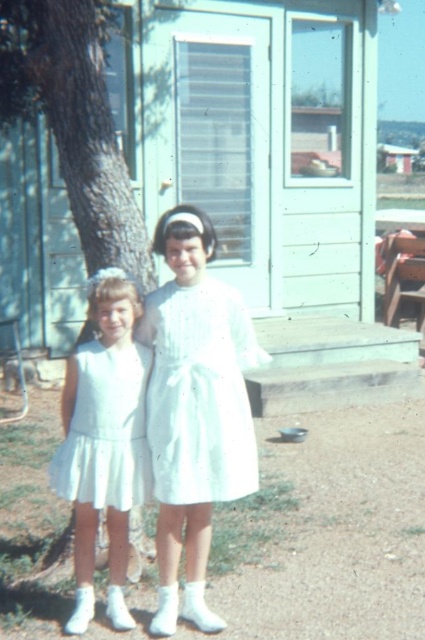
Question: Is green textured tree trunk at left wider than white satin dress at center?

Choices:
 (A) no
 (B) yes

Answer: (B)

Question: Which object is closer to the camera taking this photo?

Choices:
 (A) green textured tree trunk at left
 (B) white pleated dress at center
 (C) white satin dress at left
 (D) white satin dress at center

Answer: (D)

Question: Can you confirm if white satin dress at center is thinner than white pleated dress at center?

Choices:
 (A) yes
 (B) no

Answer: (A)

Question: Among these points, which one is nearest to the camera?

Choices:
 (A) (221, 339)
 (B) (87, 522)

Answer: (B)

Question: Among these objects, which one is nearest to the camera?

Choices:
 (A) white satin dress at left
 (B) green textured tree trunk at left
 (C) white satin dress at center
 (D) white pleated dress at center

Answer: (C)

Question: Can you confirm if green textured tree trunk at left is smaller than white satin dress at left?

Choices:
 (A) no
 (B) yes

Answer: (A)